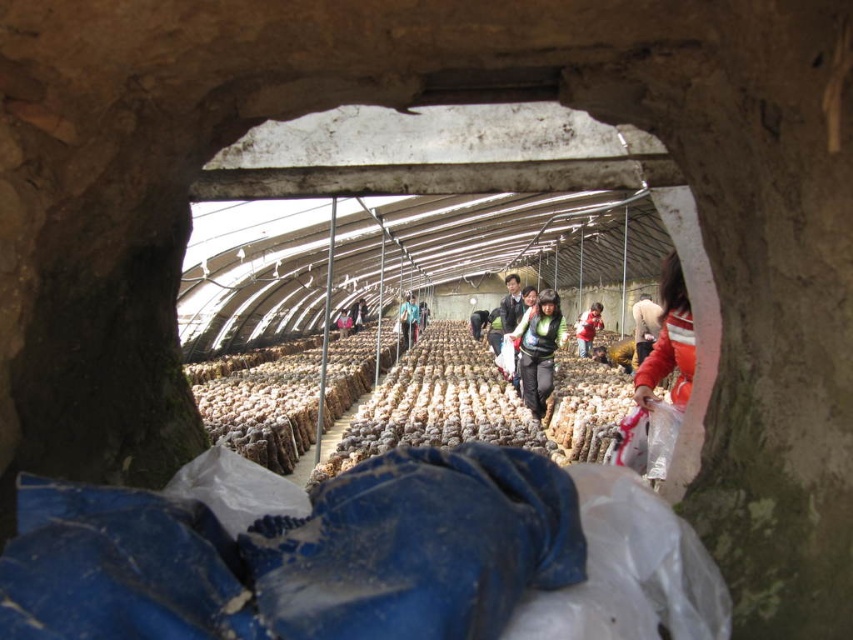
You are a worker in the mushroom farm and you need to wear a jacket to enter the facility. You have two jackets available, the red fabric jacket at center and the light brown fabric jacket at center. Which jacket is wider so that it can better protect you from the cold?

The red fabric jacket at center might be wider than the light brown fabric jacket at center, so it could provide better protection against the cold.

Based on the photo, you are standing outside the arched opening looking into the mushroom farm. There is a red fabric jacket at center. Can you see the jacket from your current position outside the opening?

Yes, the red fabric jacket at center is visible from outside the arched opening because its position at point (587, 328) is within the visible area through the opening.